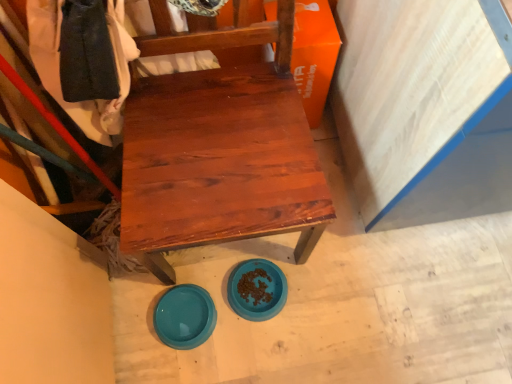
This screenshot has width=512, height=384. What are the coordinates of `free space in front of matte wood chair at center` in the screenshot? It's located at (244, 338).